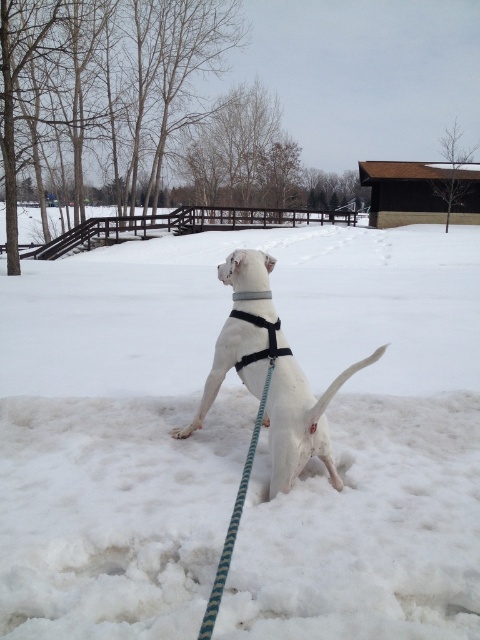
Question: Which object appears farthest from the camera in this image?

Choices:
 (A) white matte harness at center
 (B) white fluffy snow at center

Answer: (A)

Question: Based on their relative distances, which object is nearer to the white matte harness at center?

Choices:
 (A) green striped leash at center
 (B) white fluffy snow at center
 (C) gray fabric neckband at upper center

Answer: (A)

Question: Which point is closer to the camera?

Choices:
 (A) (x=262, y=408)
 (B) (x=264, y=294)
 (C) (x=225, y=348)
 (D) (x=182, y=364)

Answer: (A)

Question: From the image, what is the correct spatial relationship of green striped leash at center in relation to gray fabric neckband at upper center?

Choices:
 (A) right
 (B) left

Answer: (B)

Question: Is white fluffy snow at center bigger than green striped leash at center?

Choices:
 (A) yes
 (B) no

Answer: (A)

Question: Can you confirm if white fluffy snow at center is positioned below green striped leash at center?

Choices:
 (A) no
 (B) yes

Answer: (A)